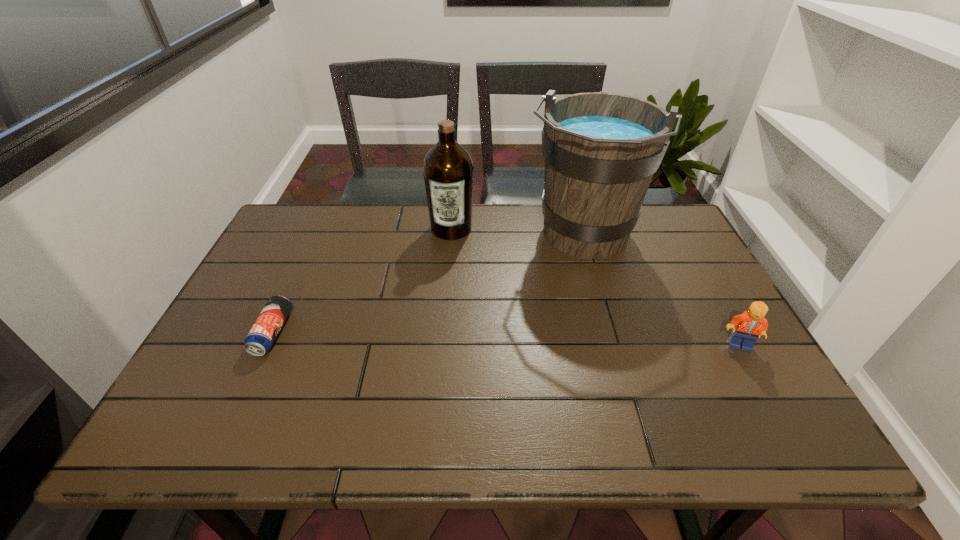
Find the location of a particular element. The image size is (960, 540). wine bucket located at the right edge is located at coordinates (601, 150).

Find the location of `object situated at the far right corner`. object situated at the far right corner is located at coordinates (601, 150).

The height and width of the screenshot is (540, 960). What are the coordinates of `free space at the far edge` in the screenshot? It's located at (499, 217).

Image resolution: width=960 pixels, height=540 pixels. What are the coordinates of `blank space at the near edge` in the screenshot? It's located at (643, 375).

What are the coordinates of `vacant space at the left edge of the desktop` in the screenshot? It's located at (257, 367).

In the image, there is a desktop. Where is `free space at the far left corner`? The image size is (960, 540). free space at the far left corner is located at coordinates (292, 218).

At what (x,y) coordinates should I click in order to perform the action: click on vacant space at the near right corner. Please return your answer as a coordinate pair (x, y). Looking at the image, I should click on (737, 394).

Locate an element on the screen. vacant area that lies between the shortest object and the Lego is located at coordinates (506, 339).

Image resolution: width=960 pixels, height=540 pixels. Find the location of `empty location between the shortest object and the olive oil`. empty location between the shortest object and the olive oil is located at coordinates (362, 281).

At what (x,y) coordinates should I click in order to perform the action: click on free spot between the tallest object and the beer can. Please return your answer as a coordinate pair (x, y). Image resolution: width=960 pixels, height=540 pixels. Looking at the image, I should click on (427, 285).